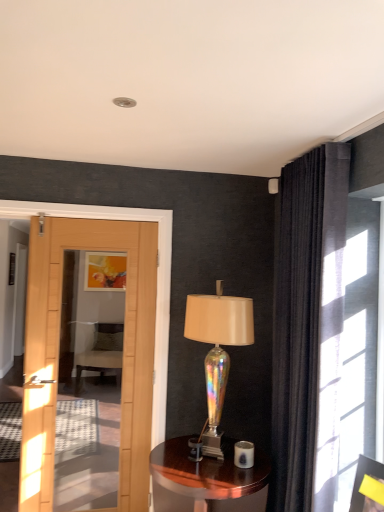
What are the coordinates of `vacant space to the left of iridescent glass lamp at center` in the screenshot? It's located at (167, 454).